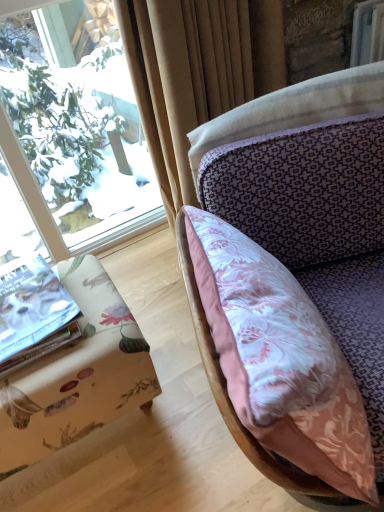
Question: Is white paper book at lower left at the left side of silky beige curtain at upper center?

Choices:
 (A) yes
 (B) no

Answer: (A)

Question: Is the position of white paper book at lower left more distant than that of silky beige curtain at upper center?

Choices:
 (A) yes
 (B) no

Answer: (B)

Question: Can silky beige curtain at upper center be found inside white paper book at lower left?

Choices:
 (A) yes
 (B) no

Answer: (B)

Question: From a real-world perspective, is white paper book at lower left located beneath silky beige curtain at upper center?

Choices:
 (A) no
 (B) yes

Answer: (B)

Question: Is white paper book at lower left not close to silky beige curtain at upper center?

Choices:
 (A) yes
 (B) no

Answer: (B)

Question: Is white paper book at lower left next to silky beige curtain at upper center and touching it?

Choices:
 (A) no
 (B) yes

Answer: (A)

Question: From a real-world perspective, is silky beige curtain at upper center physically above white paper book at lower left?

Choices:
 (A) no
 (B) yes

Answer: (B)

Question: Are silky beige curtain at upper center and white paper book at lower left located far from each other?

Choices:
 (A) no
 (B) yes

Answer: (A)

Question: Is the depth of silky beige curtain at upper center less than that of white paper book at lower left?

Choices:
 (A) yes
 (B) no

Answer: (B)

Question: Does silky beige curtain at upper center contain white paper book at lower left?

Choices:
 (A) no
 (B) yes

Answer: (A)

Question: Does silky beige curtain at upper center have a larger size compared to white paper book at lower left?

Choices:
 (A) yes
 (B) no

Answer: (A)

Question: Is silky beige curtain at upper center facing towards white paper book at lower left?

Choices:
 (A) no
 (B) yes

Answer: (A)

Question: Considering the relative positions of floral fabric ottoman at lower left and silky beige curtain at upper center in the image provided, is floral fabric ottoman at lower left to the right of silky beige curtain at upper center from the viewer's perspective?

Choices:
 (A) yes
 (B) no

Answer: (B)